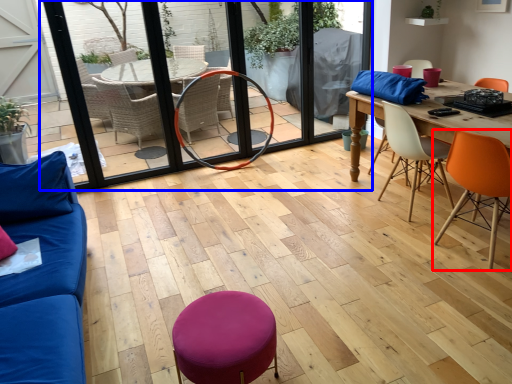
Question: Which of the following is the closest to the observer, chair (highlighted by a red box) or screen door (highlighted by a blue box)?

Choices:
 (A) chair
 (B) screen door

Answer: (A)